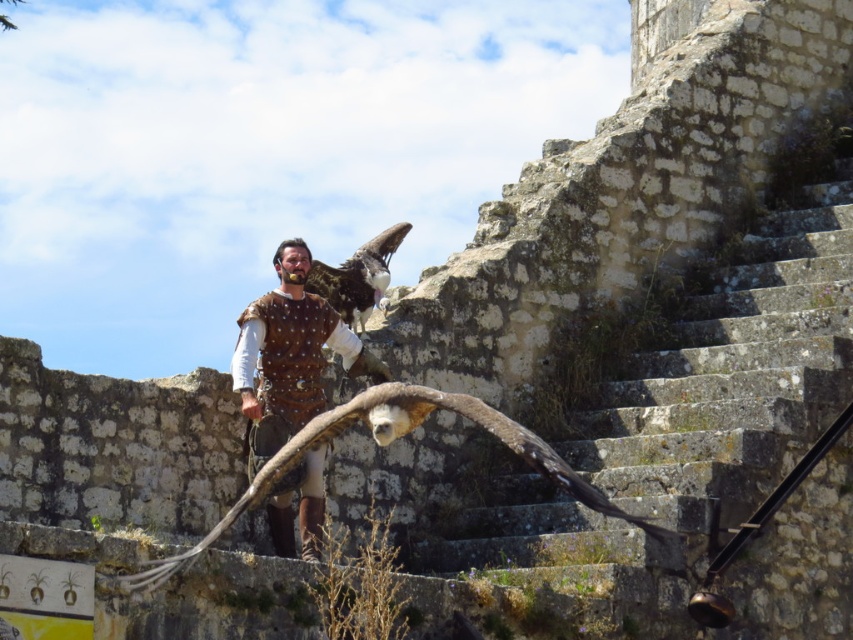
You are a bird enthusiast observing the brown feathered falcon at center and the brown feathered eagle at center. Which bird is shorter in height?

The brown feathered falcon at center is shorter than the brown feathered eagle at center.

You are an artist sketching the scene. The brown leather vest at center and the brown feathered eagle at center are both central to your drawing. Which object should you draw first if you want to ensure proper proportions?

You should draw the brown feathered eagle at center first because it occupies more space than the brown leather vest at center, allowing you to establish its size before detailing the smaller vest.

You are a costume designer preparing for a play and need to ensure that the actor wearing the brown leather vest at center can comfortably hold the brown feathered falcon at center during a scene. Given that the actor has a 1.8 meter arm span, will they be able to hold the falcon without stretching beyond their reach?

The brown leather vest at center is 2.67 meters from the brown feathered falcon at center. Since the actor has a 1.8 meter arm span, they cannot comfortably hold the falcon without stretching beyond their reach as the distance exceeds their arm span.